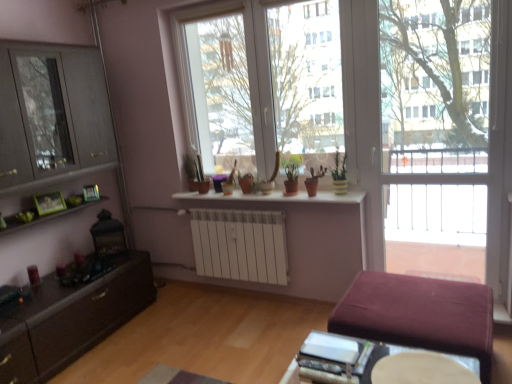
Question: Is green matte picture frame at left, the first picture frame from the left, in front of or behind transparent glass screen door at right in the image?

Choices:
 (A) front
 (B) behind

Answer: (B)

Question: From the image's perspective, is green matte picture frame at left, the first picture frame from the left, positioned above or below transparent glass screen door at right?

Choices:
 (A) below
 (B) above

Answer: (A)

Question: Considering the real-world distances, which object is closest to the transparent glass screen door at right?

Choices:
 (A) light brown wooden table at lower center
 (B) velvet maroon ottoman at lower right
 (C) green matte plant at center, the fourth houseplant from the left
 (D) green matte picture frame at left, which is the first picture frame in back-to-front order
 (E) white ceramic pots at center

Answer: (C)

Question: Based on their relative distances, which object is farther from the matte gray cabinet at left?

Choices:
 (A) green matte plant at center, the 2th houseplant positioned from the left
 (B) matte brown pot at center, arranged as the third houseplant when viewed from the left
 (C) green matte plant at center, which is the first houseplant from right to left
 (D) transparent glass window at center
 (E) white ceramic pots at center

Answer: (C)